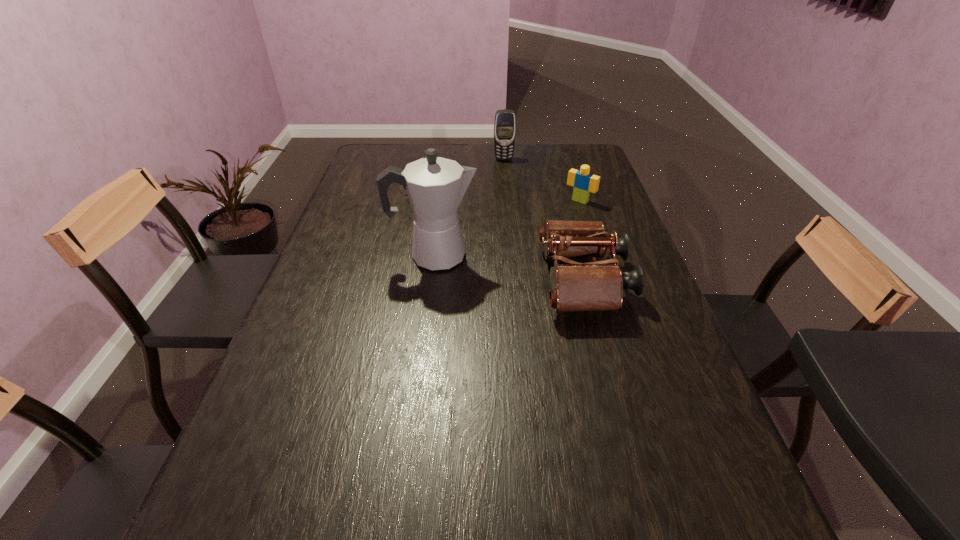
Locate an element on the screen. vacant space located 0.190m on the face of the Lego is located at coordinates (545, 233).

Identify the location of free space located 0.120m on the face of the Lego. (557, 223).

Locate an element on the screen. Image resolution: width=960 pixels, height=540 pixels. vacant space located 0.150m on the face of the Lego is located at coordinates (552, 227).

The height and width of the screenshot is (540, 960). Identify the location of vacant point located on the front-facing side of the sunglasses. (451, 213).

The image size is (960, 540). In order to click on vacant space located 0.230m on the front-facing side of the sunglasses in this screenshot , I will do `click(463, 226)`.

You are a GUI agent. You are given a task and a screenshot of the screen. Output one action in this format:
    pyautogui.click(x=<x>, y=<y>)
    Task: Click on the vacant position located 0.130m on the front-facing side of the sunglasses
    The image size is (960, 540).
    Given the screenshot: What is the action you would take?
    pyautogui.click(x=448, y=211)

The height and width of the screenshot is (540, 960). In order to click on vacant position located 0.290m on the front face of the cellular telephone in this screenshot , I will do `click(512, 201)`.

Locate an element on the screen. The height and width of the screenshot is (540, 960). free space located 0.190m on the front face of the cellular telephone is located at coordinates (509, 186).

The image size is (960, 540). What are the coordinates of `vacant region located 0.300m on the front face of the cellular telephone` in the screenshot? It's located at (512, 203).

Identify the location of sunglasses positioned at the far edge. The image size is (960, 540). (386, 167).